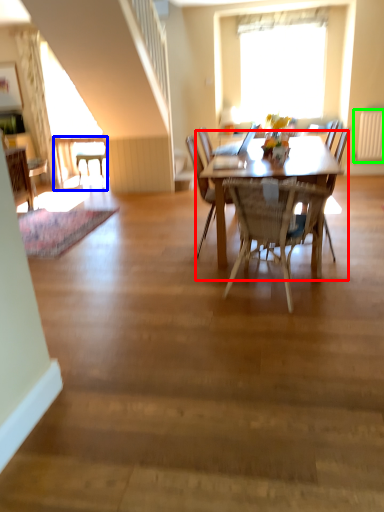
Question: Based on their relative distances, which object is nearer to kitchen & dining room table (highlighted by a red box)? Choose from desk (highlighted by a blue box) and radiator (highlighted by a green box).

Choices:
 (A) desk
 (B) radiator

Answer: (B)